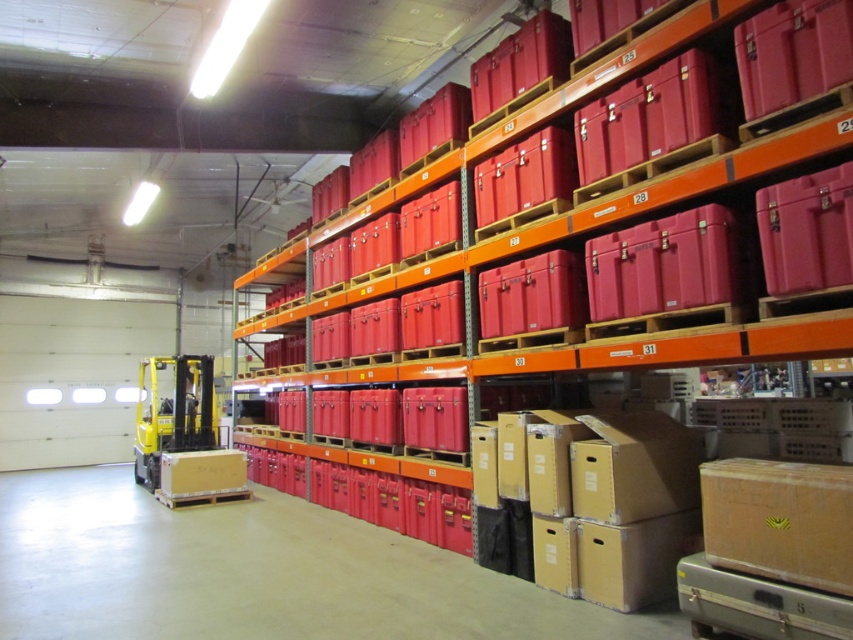
Question: Does matte red container at upper center appear on the right side of brown cardboard box at lower right?

Choices:
 (A) no
 (B) yes

Answer: (A)

Question: Which of the following is the farthest from the observer?

Choices:
 (A) (730, 515)
 (B) (494, 456)

Answer: (B)

Question: Can you confirm if matte red container at upper center is positioned to the right of brown cardboard box at lower right?

Choices:
 (A) yes
 (B) no

Answer: (B)

Question: Can you confirm if matte red container at upper center is thinner than brown cardboard box at lower right?

Choices:
 (A) no
 (B) yes

Answer: (B)